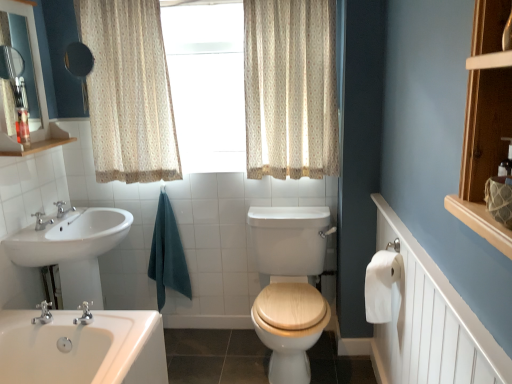
Question: Would you say beige floral fabric curtain at upper center, the first curtain positioned from the left, is to the left or to the right of white paper at right in the picture?

Choices:
 (A) right
 (B) left

Answer: (B)

Question: Do you think beige floral fabric curtain at upper center, the 2th curtain in the right-to-left sequence, is within white paper at right, or outside of it?

Choices:
 (A) outside
 (B) inside

Answer: (A)

Question: Which of these objects is positioned farthest from the matte black mirror at upper left?

Choices:
 (A) teal cotton towel at center
 (B) brushed metal faucet at left, the 2th tap positioned from the front
 (C) white textured radiator at right
 (D) beige floral fabric curtain at upper center, the 2th curtain in the right-to-left sequence
 (E) brushed metal faucet at left, acting as the 3th tap starting from the bottom

Answer: (C)

Question: Which is nearer to the beige floral fabric curtain at upper center, which is the first curtain from right to left?

Choices:
 (A) beige floral fabric curtain at upper center, the first curtain positioned from the left
 (B) matte black mirror at upper left
 (C) brushed metal faucet at left, acting as the 3th tap starting from the bottom
 (D) brushed metal faucet at left, which ranks as the second tap in bottom-to-top order
 (E) teal cotton towel at center

Answer: (A)